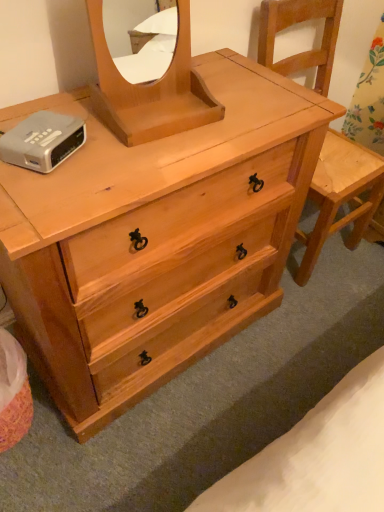
This screenshot has width=384, height=512. What are the coordinates of `unoccupied region to the right of natural wood mirror at center` in the screenshot? It's located at (235, 121).